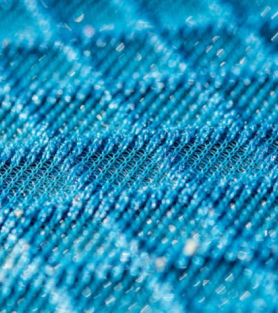
The image size is (278, 313). In order to click on fabric weave in this screenshot , I will do `click(111, 160)`, `click(113, 171)`, `click(124, 169)`, `click(138, 169)`, `click(151, 173)`.